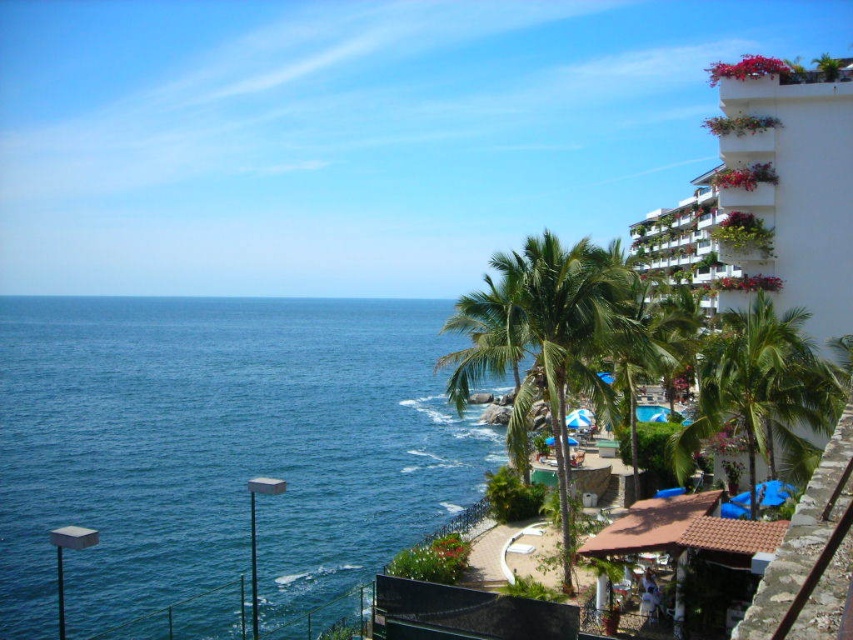
Is blue water at left shorter than white glossy building at upper right?

Incorrect, blue water at left's height does not fall short of white glossy building at upper right's.

Is point (62, 502) less distant than point (724, 250)?

No, it is behind (724, 250).

Does point (93, 579) come farther from viewer compared to point (712, 177)?

No, it is not.

Find the location of `blue water at left`. blue water at left is located at coordinates (219, 449).

Who is positioned more to the left, white glossy building at upper right or green leafy palm tree at right?

From the viewer's perspective, green leafy palm tree at right appears more on the left side.

Is white glossy building at upper right positioned at the back of green leafy palm tree at right?

Yes, white glossy building at upper right is behind green leafy palm tree at right.

Does point (828, 243) lie in front of point (704, 436)?

No, it is not.

This screenshot has height=640, width=853. In order to click on white glossy building at upper right in this screenshot , I will do `click(767, 196)`.

Is blue water at left positioned behind green leafy palm tree at right?

That is True.

In the scene shown: Does blue water at left appear on the right side of green leafy palm tree at right?

No, blue water at left is not to the right of green leafy palm tree at right.

This screenshot has width=853, height=640. What do you see at coordinates (219, 449) in the screenshot? I see `blue water at left` at bounding box center [219, 449].

Identify the location of blue water at left. (219, 449).